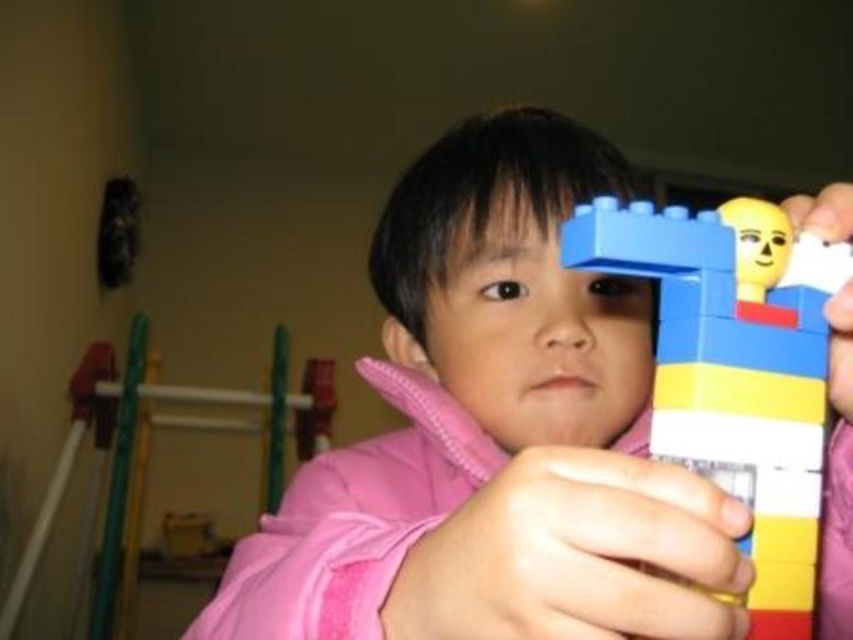
Question: Among these objects, which one is farthest from the camera?

Choices:
 (A) brick-like plastic toy at upper right
 (B) matte plastic toy at center

Answer: (A)

Question: Which of the following is the closest to the observer?

Choices:
 (A) (780, 403)
 (B) (552, 152)

Answer: (A)

Question: Is matte plastic toy at center bigger than brick-like plastic toy at upper right?

Choices:
 (A) no
 (B) yes

Answer: (B)

Question: Does matte plastic toy at center appear under brick-like plastic toy at upper right?

Choices:
 (A) yes
 (B) no

Answer: (A)

Question: Does matte plastic toy at center have a greater width compared to brick-like plastic toy at upper right?

Choices:
 (A) yes
 (B) no

Answer: (A)